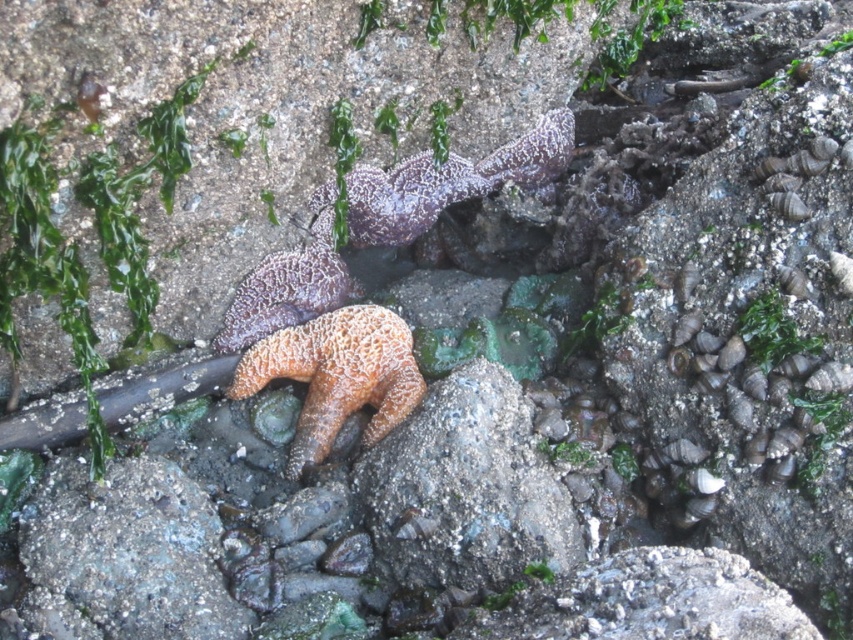
Question: Observing the image, what is the correct spatial positioning of orange rough starfish at center in reference to textured purple starfish at center?

Choices:
 (A) above
 (B) below

Answer: (B)

Question: Which point is closer to the camera?

Choices:
 (A) (804, 342)
 (B) (553, 116)
 (C) (410, 410)
 (D) (247, 275)

Answer: (A)

Question: Which point is closer to the camera taking this photo?

Choices:
 (A) (339, 424)
 (B) (262, 304)
 (C) (463, 195)
 (D) (747, 342)

Answer: (D)

Question: Is orange rough starfish at center bigger than green matte algae at center right?

Choices:
 (A) yes
 (B) no

Answer: (A)

Question: Is purple matte starfish at center bigger than green matte algae at center right?

Choices:
 (A) no
 (B) yes

Answer: (B)

Question: Which object is positioned farthest from the purple matte starfish at center?

Choices:
 (A) textured purple starfish at center
 (B) green matte algae at center right
 (C) orange rough starfish at center

Answer: (B)